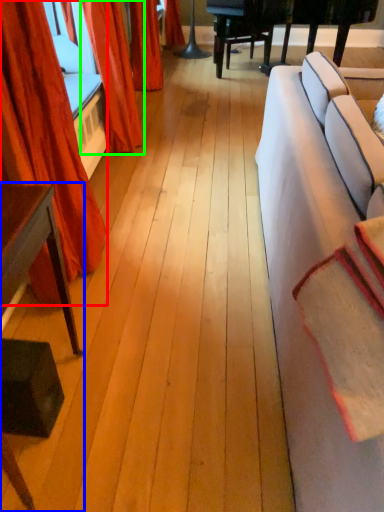
Question: Based on their relative distances, which object is farther from curtain (highlighted by a red box)? Choose from table (highlighted by a blue box) and curtain (highlighted by a green box).

Choices:
 (A) table
 (B) curtain

Answer: (B)